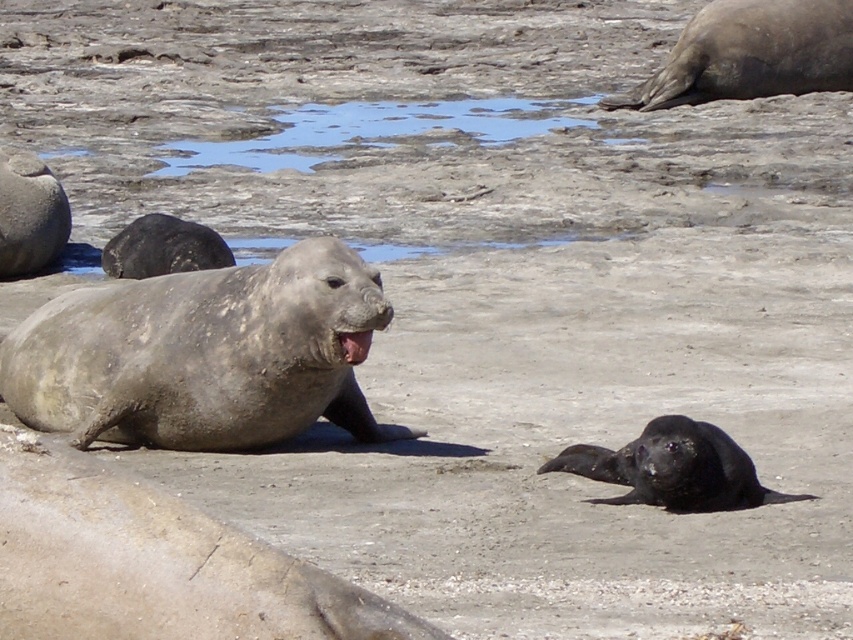
Question: Which object is farther from the camera taking this photo?

Choices:
 (A) gray matte seal mouth at left
 (B) black fur seal at lower right
 (C) gray matte seal at upper right

Answer: (C)

Question: Is black fur seal at lower right smaller than gray matte seal mouth at center?

Choices:
 (A) no
 (B) yes

Answer: (A)

Question: Does gray matte seal at upper right have a larger size compared to black fur seal at lower right?

Choices:
 (A) no
 (B) yes

Answer: (B)

Question: Which point is closer to the camera?

Choices:
 (A) gray matte seal mouth at center
 (B) gray matte seal mouth at left
 (C) black fur seal at lower right

Answer: (C)

Question: Is gray matte seal at upper right closer to the viewer compared to black fur seal at lower right?

Choices:
 (A) yes
 (B) no

Answer: (B)

Question: Estimate the real-world distances between objects in this image. Which object is closer to the gray matte seal mouth at center?

Choices:
 (A) black fur seal at lower right
 (B) gray matte seal at upper right

Answer: (A)